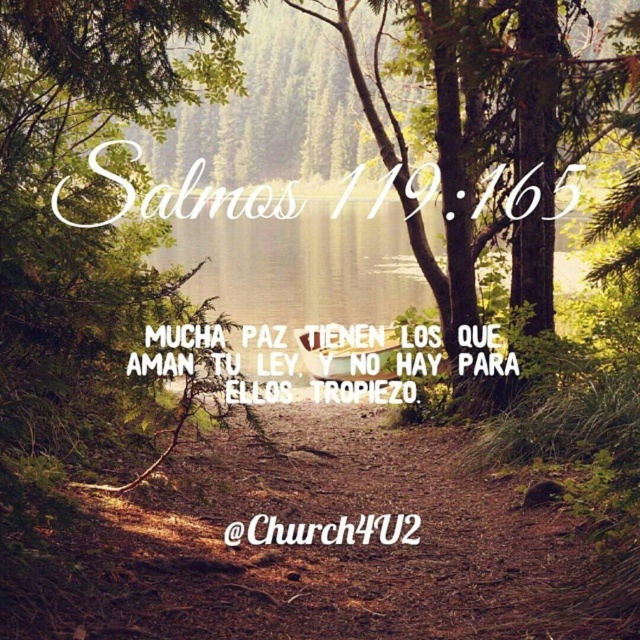
Which is behind, point (337, 204) or point (371, 525)?

Positioned behind is point (337, 204).

Where is `white script text at upper center`? This screenshot has width=640, height=640. white script text at upper center is located at coordinates (218, 198).

Who is positioned more to the left, green matte tree at center or white wood sign at center?

Positioned to the left is white wood sign at center.

Find the location of `green matte tree at center`. green matte tree at center is located at coordinates (100, 164).

In order to click on white paper text at center in this screenshot , I will do `click(365, 362)`.

Is white paper text at center above white script text at upper center?

Actually, white paper text at center is below white script text at upper center.

Is point (211, 369) more distant than point (196, 212)?

No, (211, 369) is closer to viewer.

Where is `white paper text at center`? white paper text at center is located at coordinates (365, 362).